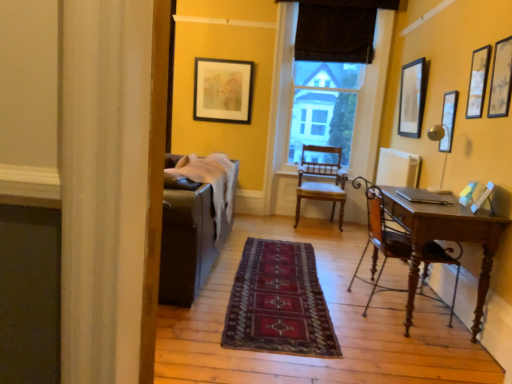
Where is `free spot in front of wooden chair at right, marked as the 2th chair in a back-to-front arrangement`? free spot in front of wooden chair at right, marked as the 2th chair in a back-to-front arrangement is located at coordinates (407, 344).